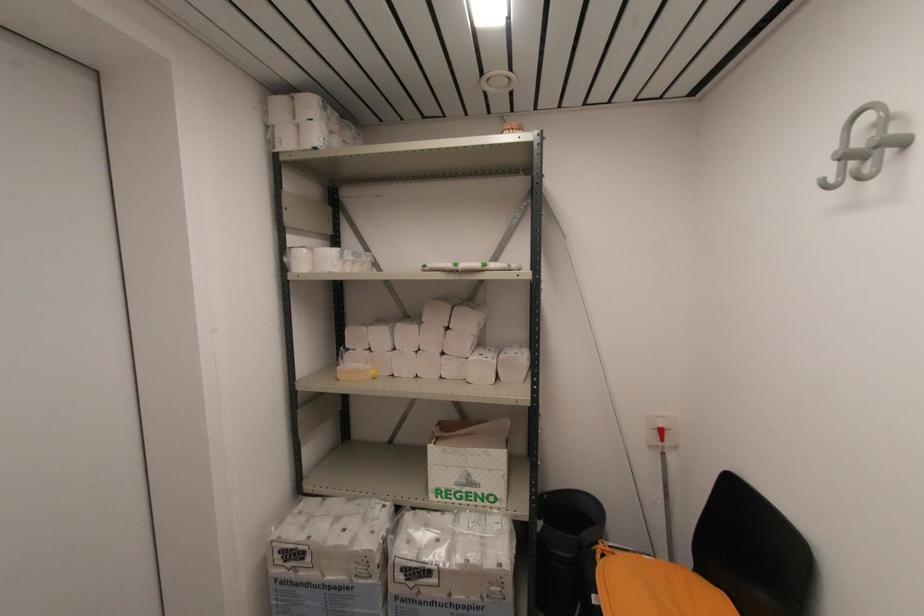
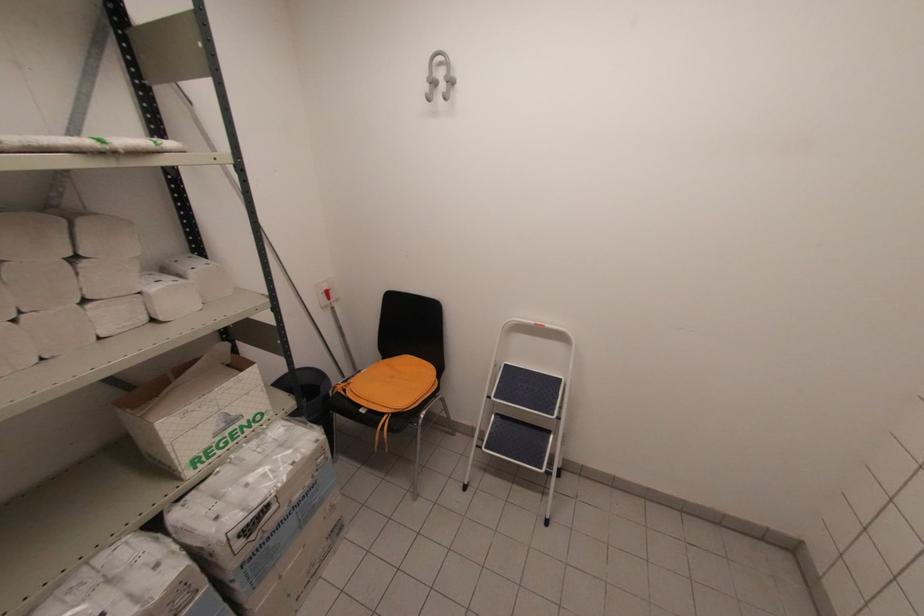
Where in the second image is the point corresponding to (x=447, y=326) from the first image?

(71, 254)